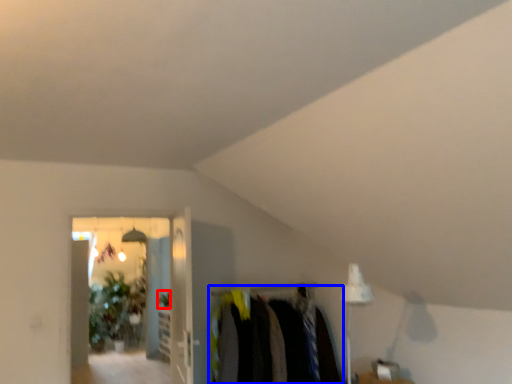
Question: Which of the following is the closest to the observer, plant (highlighted by a red box) or closet (highlighted by a blue box)?

Choices:
 (A) plant
 (B) closet

Answer: (B)